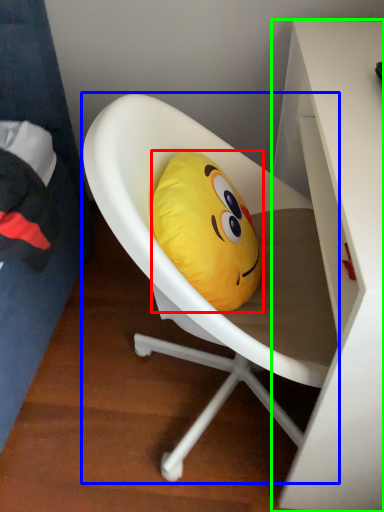
Question: Which is farther away from pillow (highlighted by a red box)? chair (highlighted by a blue box) or desk (highlighted by a green box)?

Choices:
 (A) chair
 (B) desk

Answer: (B)